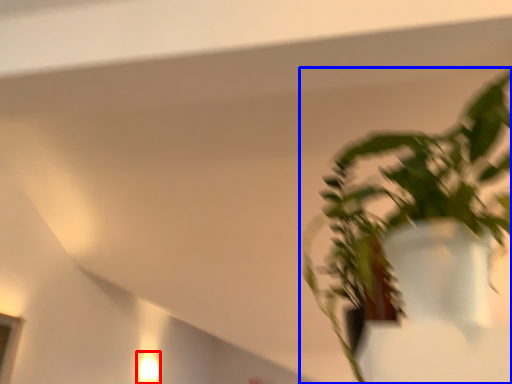
Question: Which object is further to the camera taking this photo, light fixture (highlighted by a red box) or houseplant (highlighted by a blue box)?

Choices:
 (A) light fixture
 (B) houseplant

Answer: (A)